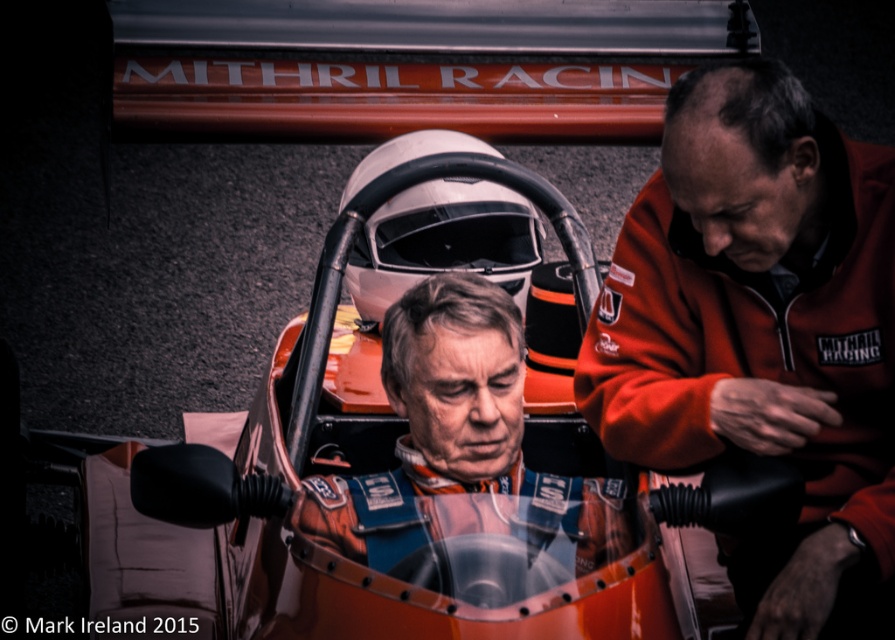
Question: Is orange metallic car at center wider than orange softshell jacket at right?

Choices:
 (A) no
 (B) yes

Answer: (B)

Question: Is orange softshell jacket at right below matte orange racing suit at center?

Choices:
 (A) yes
 (B) no

Answer: (B)

Question: Does orange metallic car at center have a larger size compared to matte orange racing suit at center?

Choices:
 (A) no
 (B) yes

Answer: (B)

Question: Which of the following is the farthest from the observer?

Choices:
 (A) matte orange racing suit at center
 (B) orange metallic car at center
 (C) orange softshell jacket at right

Answer: (C)

Question: Which object is farther from the camera taking this photo?

Choices:
 (A) matte orange racing suit at center
 (B) orange metallic car at center
 (C) orange softshell jacket at right

Answer: (C)

Question: Which is nearer to the orange metallic car at center?

Choices:
 (A) orange softshell jacket at right
 (B) matte orange racing suit at center

Answer: (B)